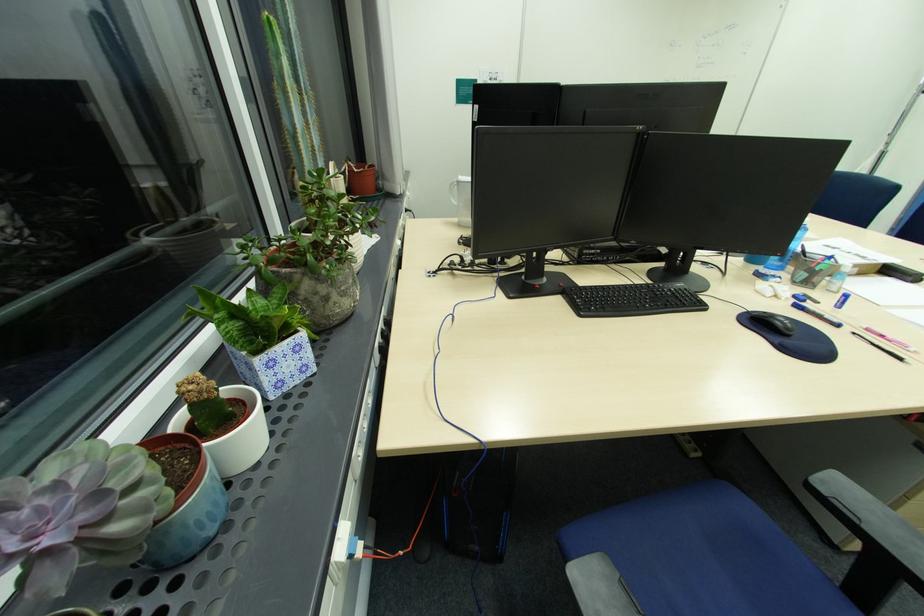
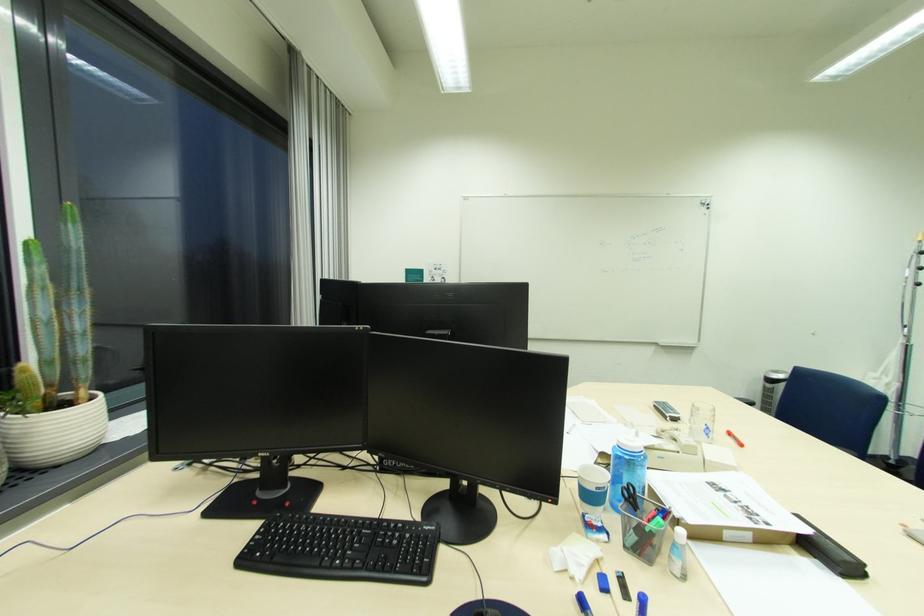
The point at (824,304) is marked in the first image. Where is the corresponding point in the second image?

(636, 601)